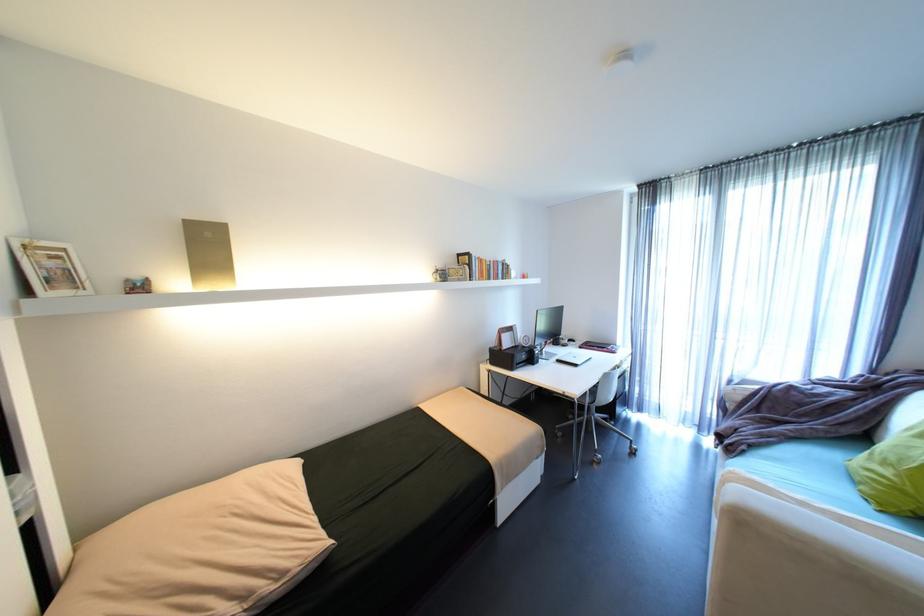
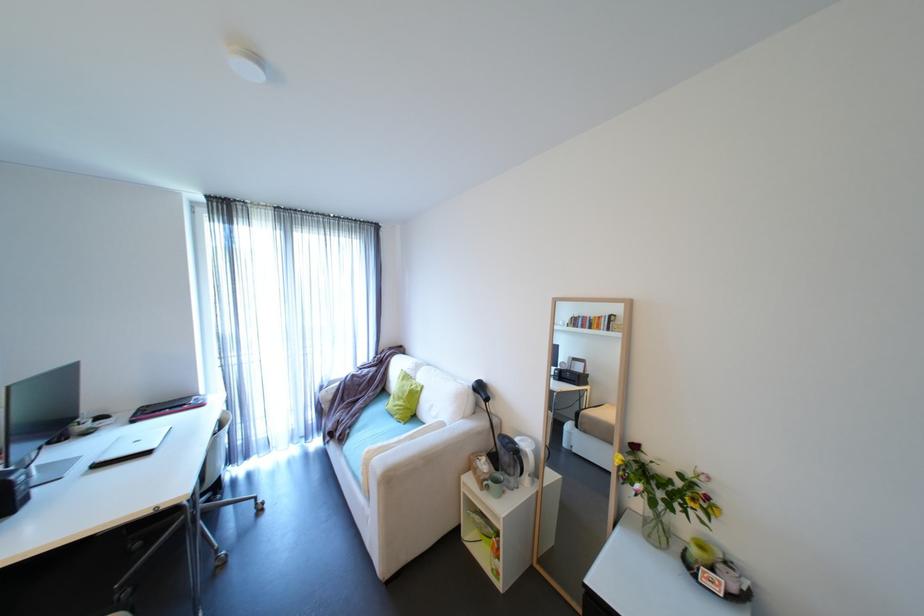
Find the pixel in the second image that matches point (639, 294) in the first image.

(225, 326)